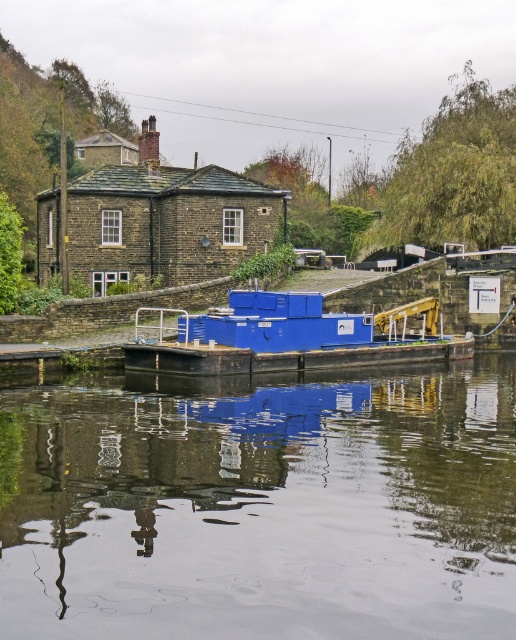
Question: Is smooth reflective water at center in front of blue matte container at center?

Choices:
 (A) yes
 (B) no

Answer: (A)

Question: Does smooth reflective water at center appear under blue matte container at center?

Choices:
 (A) no
 (B) yes

Answer: (B)

Question: Which of the following is the closest to the observer?

Choices:
 (A) (421, 310)
 (B) (262, 496)

Answer: (B)

Question: Can you confirm if smooth reflective water at center is positioned to the left of blue matte container at center?

Choices:
 (A) yes
 (B) no

Answer: (B)